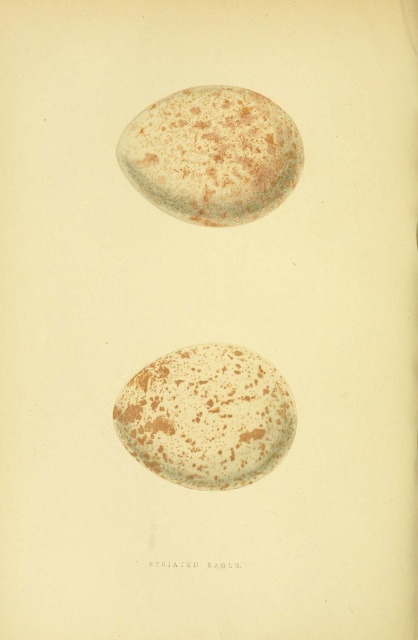
You are a researcher examining two STRIATED EAGLE eggs in an illustration. You need to determine which egg is bigger. The eggs are labeled as the speckled egg at bottom and the speckled egg at upper center. Based on their positions, can you identify which one is larger?

The speckled egg at bottom is larger in size than the speckled egg at upper center.

You are an ornithologist examining two STRIATED EAGLE eggs in an illustration. The eggs are labeled as speckled egg at bottom and speckled egg at upper center. Based on their positions, which egg do you think is taller?

The speckled egg at bottom is taller than the speckled egg at upper center according to the illustration.

Looking at this image, you are examining a scientific illustration of two STRIATED EAGLE eggs. You notice two points labeled as point 1 and point 2. If point 1 is at coordinate [219,346] and point 2 is at [152,122], which point is closer to you?

Point 1 at coordinate [219,346] is closer to you than point 2 at [152,122].